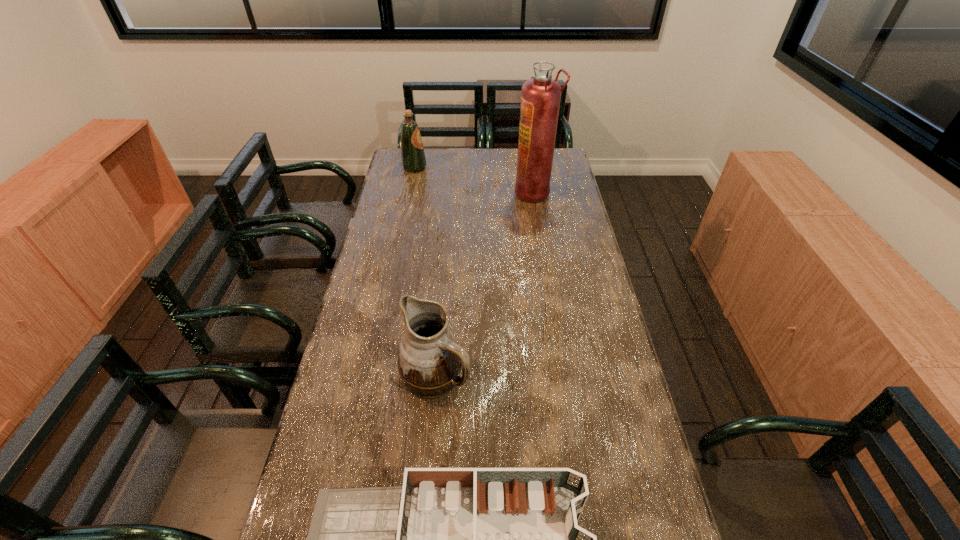
The height and width of the screenshot is (540, 960). I want to click on fire extinguisher, so click(x=540, y=98).

Locate an element on the screen. The height and width of the screenshot is (540, 960). the tallest object is located at coordinates (540, 98).

Where is `the third farthest object`? This screenshot has height=540, width=960. the third farthest object is located at coordinates (429, 360).

The width and height of the screenshot is (960, 540). In order to click on the farthest object in this screenshot , I will do `click(413, 159)`.

The width and height of the screenshot is (960, 540). What are the coordinates of `free space located 0.080m on the side of the third nearest object with the label` in the screenshot? It's located at tap(495, 193).

At what (x,y) coordinates should I click in order to perform the action: click on blank space located on the side of the third nearest object with the label. Please return your answer as a coordinate pair (x, y). The height and width of the screenshot is (540, 960). Looking at the image, I should click on (479, 193).

Identify the location of free space located on the side of the third nearest object with the label. (454, 193).

Identify the location of free region located from the spout of the pitcher. The width and height of the screenshot is (960, 540). (586, 375).

This screenshot has width=960, height=540. I want to click on free space located 0.100m on the front-facing side of the olive oil, so click(x=448, y=167).

This screenshot has width=960, height=540. Find the location of `object that is at the far edge`. object that is at the far edge is located at coordinates (413, 159).